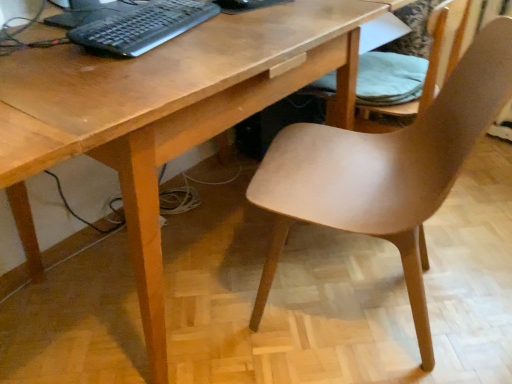
Question: Can you confirm if matte wood chair at lower right, arranged as the second chair when viewed from the front, is thinner than matte wood chair at center, arranged as the second chair when viewed from the back?

Choices:
 (A) no
 (B) yes

Answer: (B)

Question: From a real-world perspective, is matte wood chair at lower right, arranged as the second chair when viewed from the front, below matte wood chair at center, which is the 1th chair from front to back?

Choices:
 (A) no
 (B) yes

Answer: (A)

Question: From the image's perspective, is matte wood chair at lower right, marked as the 1th chair in a back-to-front arrangement, beneath matte wood chair at center, arranged as the second chair when viewed from the back?

Choices:
 (A) yes
 (B) no

Answer: (B)

Question: Does matte wood chair at lower right, arranged as the second chair when viewed from the front, have a larger size compared to matte wood chair at center, arranged as the second chair when viewed from the back?

Choices:
 (A) no
 (B) yes

Answer: (A)

Question: Is matte wood chair at lower right, marked as the 1th chair in a back-to-front arrangement, at the right side of matte wood chair at center, which is the 1th chair from front to back?

Choices:
 (A) no
 (B) yes

Answer: (B)

Question: Looking at their shapes, would you say matte wood chair at lower right, marked as the 1th chair in a back-to-front arrangement, is wider or thinner than black plastic keyboard at upper left?

Choices:
 (A) thin
 (B) wide

Answer: (B)

Question: From the image's perspective, relative to black plastic keyboard at upper left, is matte wood chair at lower right, arranged as the second chair when viewed from the front, above or below?

Choices:
 (A) below
 (B) above

Answer: (A)

Question: Relative to black plastic keyboard at upper left, is matte wood chair at lower right, marked as the 1th chair in a back-to-front arrangement, in front or behind?

Choices:
 (A) front
 (B) behind

Answer: (B)

Question: Based on their sizes in the image, would you say matte wood chair at lower right, marked as the 1th chair in a back-to-front arrangement, is bigger or smaller than black plastic keyboard at upper left?

Choices:
 (A) small
 (B) big

Answer: (B)

Question: Would you say matte wood chair at lower right, arranged as the second chair when viewed from the front, is to the left or to the right of matte wood chair at center, arranged as the second chair when viewed from the back, in the picture?

Choices:
 (A) right
 (B) left

Answer: (A)

Question: In the image, is matte wood chair at lower right, marked as the 1th chair in a back-to-front arrangement, positioned in front of or behind matte wood chair at center, which is the 1th chair from front to back?

Choices:
 (A) front
 (B) behind

Answer: (B)

Question: Considering the positions of point (445, 23) and point (376, 150), is point (445, 23) closer or farther from the camera than point (376, 150)?

Choices:
 (A) farther
 (B) closer

Answer: (A)

Question: Is matte wood chair at lower right, arranged as the second chair when viewed from the front, wider or thinner than matte wood chair at center, which is the 1th chair from front to back?

Choices:
 (A) wide
 (B) thin

Answer: (B)

Question: Considering their positions, is black plastic keyboard at upper left located in front of or behind matte wood chair at center, arranged as the second chair when viewed from the back?

Choices:
 (A) front
 (B) behind

Answer: (B)

Question: Is point (173, 13) closer or farther from the camera than point (407, 256)?

Choices:
 (A) closer
 (B) farther

Answer: (B)